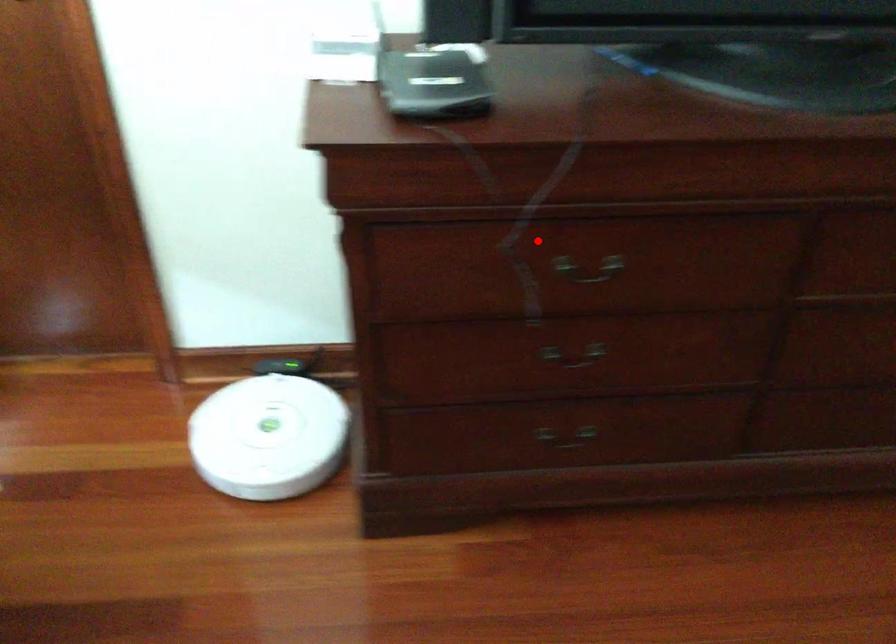
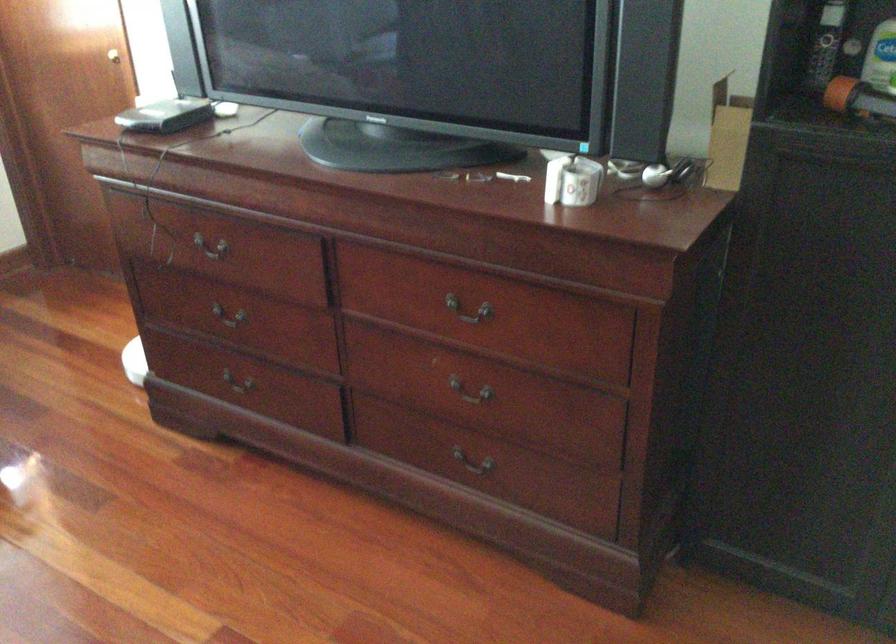
Question: I am providing you with two images of the same scene from different viewpoints. A red point is shown in image1. For the corresponding object point in image2, is it positioned nearer or farther from the camera?

Choices:
 (A) Nearer
 (B) Farther

Answer: (B)